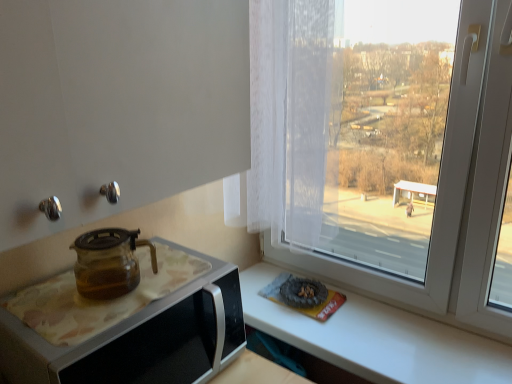
Where is `free space above transparent glass teapot at left (from a real-world perspective)`? The height and width of the screenshot is (384, 512). free space above transparent glass teapot at left (from a real-world perspective) is located at coordinates (120, 291).